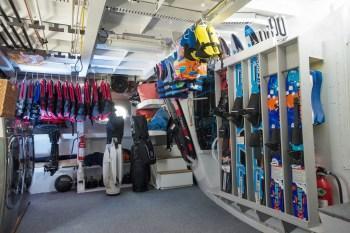
Find the location of a particular element. This screenshot has width=350, height=233. window is located at coordinates (118, 111).